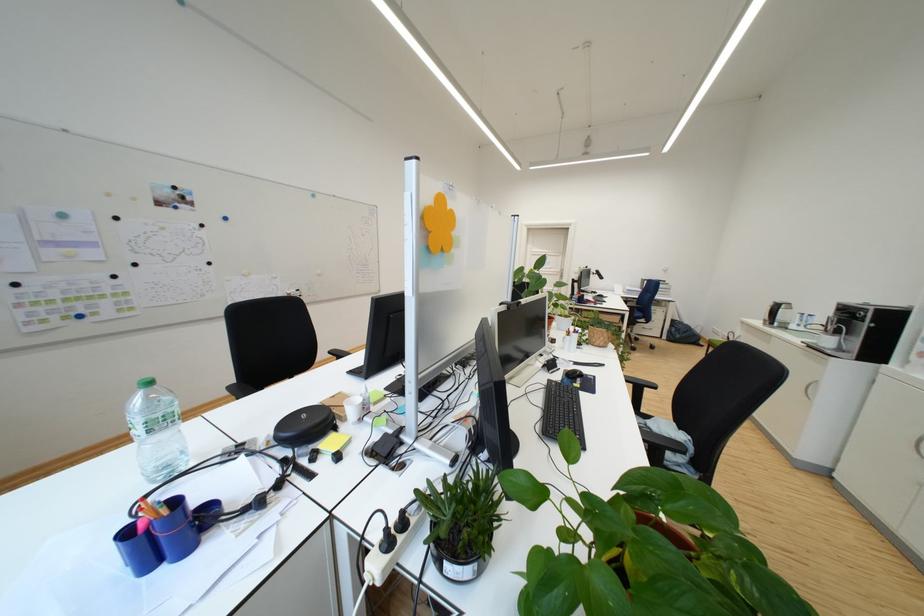
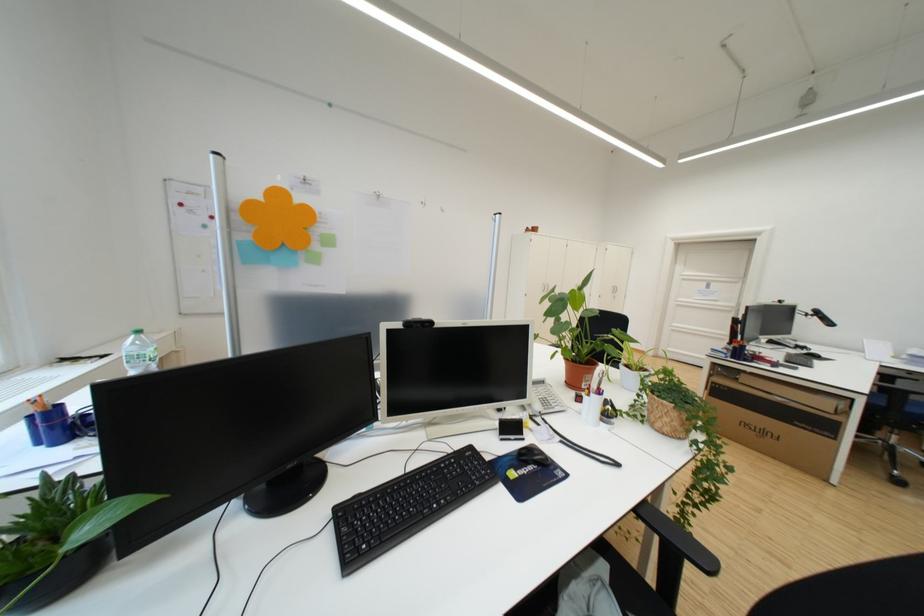
In the second image, find the point that corresponds to the point at 659,392 in the first image.

(700, 567)